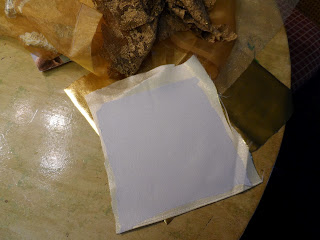
This screenshot has width=320, height=240. What are the coordinates of `maroon square fabric` in the screenshot? It's located at (298, 31).